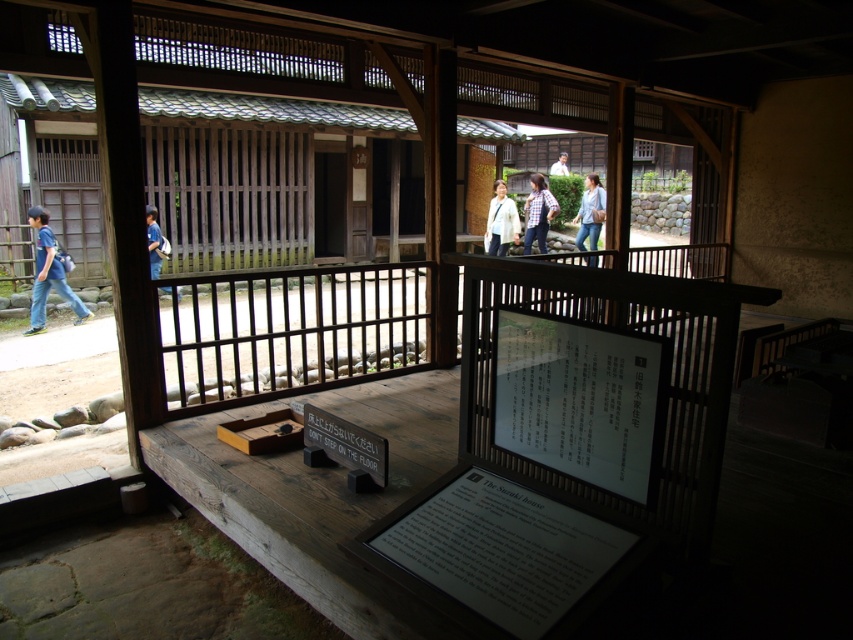
In the scene shown: You are a visitor at the Suwaki house exhibit. You see a blue fabric backpack at left and a wooden box at center. Which object is wider?

The blue fabric backpack at left is wider than the wooden box at center.